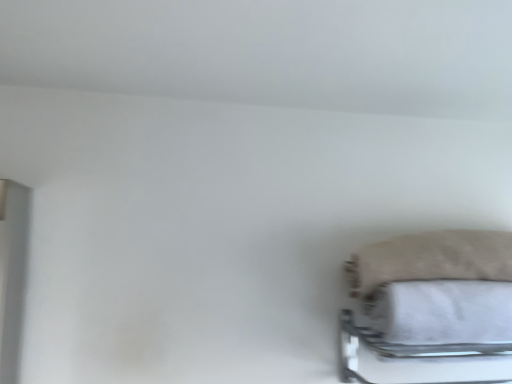
Question: Is white fabric bath towel at lower right bigger or smaller than beige fuzzy pillow at lower right?

Choices:
 (A) big
 (B) small

Answer: (B)

Question: From a real-world perspective, is white fabric bath towel at lower right positioned above or below beige fuzzy pillow at lower right?

Choices:
 (A) below
 (B) above

Answer: (A)

Question: Which object is positioned farthest from the beige fuzzy pillow at lower right?

Choices:
 (A) white fabric bath towel at lower right
 (B) metallic silver bed frame at lower right

Answer: (B)

Question: Which of these objects is positioned farthest from the metallic silver bed frame at lower right?

Choices:
 (A) beige fuzzy pillow at lower right
 (B) white fabric bath towel at lower right

Answer: (A)